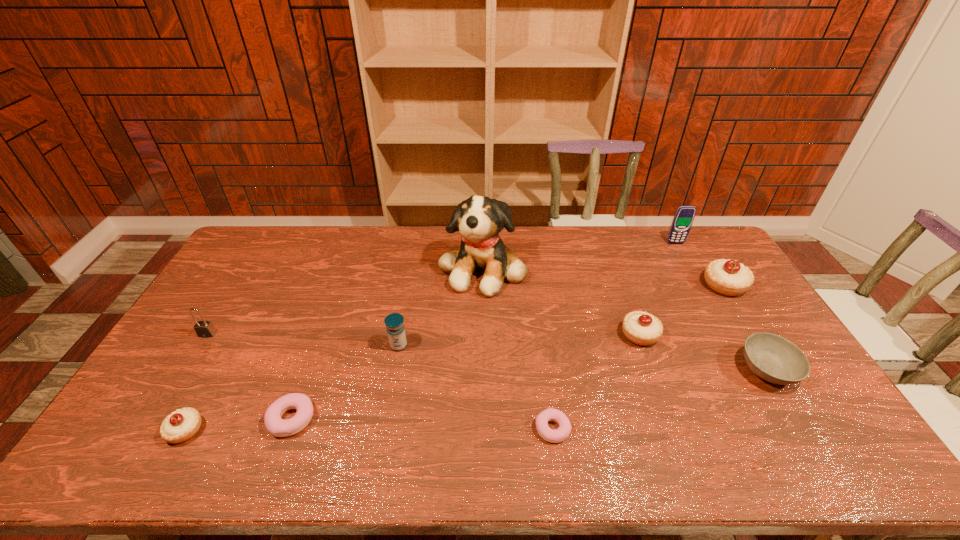
Identify the location of the tallest object. The height and width of the screenshot is (540, 960). (480, 219).

The image size is (960, 540). Find the location of `the second tallest object`. the second tallest object is located at coordinates (684, 216).

In order to click on the farthest beige pastry in this screenshot , I will do `click(727, 277)`.

Find the location of a particular element. the rightmost beige pastry is located at coordinates pos(727,277).

Find the location of `padlock`. padlock is located at coordinates (205, 329).

Find the location of a particular element. Image resolution: width=960 pixels, height=540 pixels. gray padlock is located at coordinates (205, 329).

Where is `blue medicine`? blue medicine is located at coordinates (394, 322).

Locate an element on the screen. Image resolution: width=960 pixels, height=540 pixels. the seventh object from right to left is located at coordinates (394, 322).

This screenshot has height=540, width=960. Identify the location of the fourth object from right to left. click(641, 328).

What are the coordinates of `the fourth pastry from left to right` in the screenshot? It's located at (641, 328).